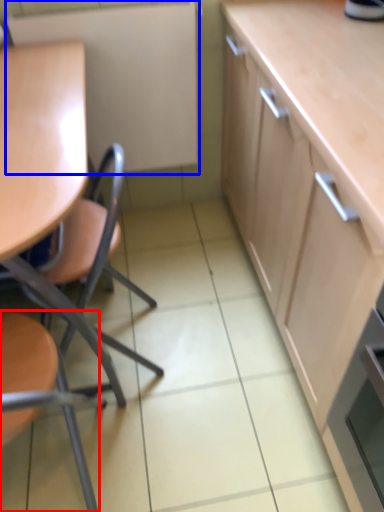
Question: Among these objects, which one is farthest to the camera, chair (highlighted by a red box) or appliance (highlighted by a blue box)?

Choices:
 (A) chair
 (B) appliance

Answer: (B)